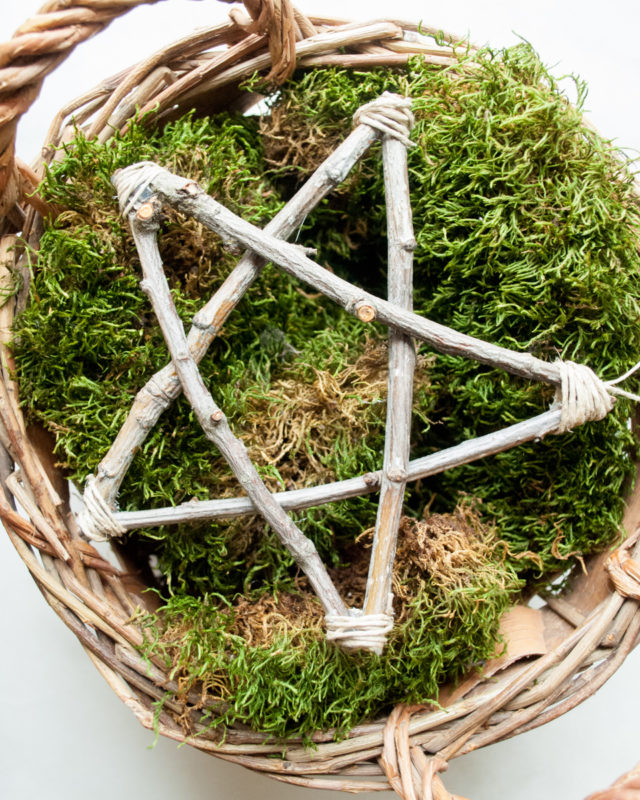
Locate an element on the screen. The width and height of the screenshot is (640, 800). right handle of basket is located at coordinates (634, 786).